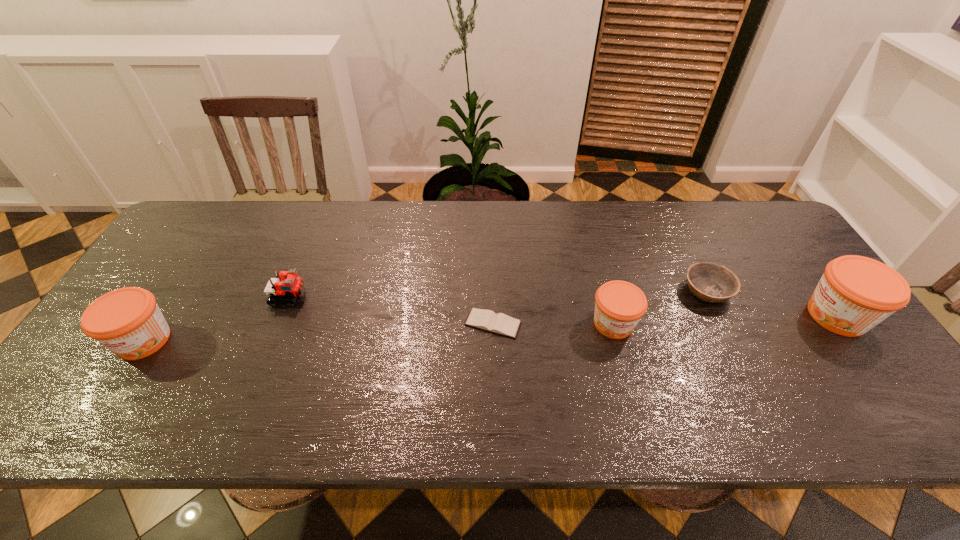
Locate an element on the screen. This screenshot has height=540, width=960. vacant area between the rightmost jam and the fifth object from left to right is located at coordinates (772, 303).

Where is `vacant area that lies between the fourth object from right to left and the Lego`? vacant area that lies between the fourth object from right to left and the Lego is located at coordinates (391, 310).

In order to click on vacant area that lies between the fourth object from right to left and the third object from right to left in this screenshot , I will do `click(553, 323)`.

Find the location of a particular element. The height and width of the screenshot is (540, 960). vacant space that's between the fourth object from left to right and the fifth object from left to right is located at coordinates (660, 307).

Locate an element on the screen. object that is the fifth closest one to the fifth shortest object is located at coordinates (856, 293).

Select which object is the closest to the fifth object from right to left. Please provide its 2D coordinates. Your answer should be formatted as a tuple, i.e. [(x, y)], where the tuple contains the x and y coordinates of a point satisfying the conditions above.

[(127, 321)]

Choose which jam is the second nearest neighbor to the fourth object from left to right. Please provide its 2D coordinates. Your answer should be formatted as a tuple, i.e. [(x, y)], where the tuple contains the x and y coordinates of a point satisfying the conditions above.

[(127, 321)]

You are a GUI agent. You are given a task and a screenshot of the screen. Output one action in this format:
    pyautogui.click(x=<x>, y=<y>)
    Task: Click on the jam that stands as the second closest to the bowl
    
    Given the screenshot: What is the action you would take?
    pyautogui.click(x=856, y=293)

At what (x,y) coordinates should I click in order to perform the action: click on vacant space that satisfies the following two spatial constraints: 1. on the front-facing side of the third object from left to right; 2. on the right side of the Lego. Please return your answer as a coordinate pair (x, y). Looking at the image, I should click on (278, 323).